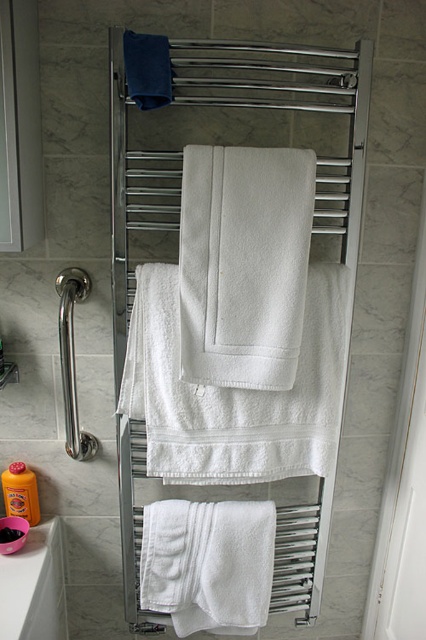
Who is lower down, chrome metallic grab bar at left or orange liquid soap at lower left?

orange liquid soap at lower left is below.

Is chrome metallic grab bar at left smaller than orange liquid soap at lower left?

No.

Where is `chrome metallic grab bar at left`? This screenshot has width=426, height=640. chrome metallic grab bar at left is located at coordinates (71, 360).

How much distance is there between white cotton towel at center and white ceramic sink at lower left?

white cotton towel at center is 18.27 inches away from white ceramic sink at lower left.

What do you see at coordinates (235, 392) in the screenshot? I see `white cotton towel at center` at bounding box center [235, 392].

Where is `white cotton towel at center`? This screenshot has height=640, width=426. white cotton towel at center is located at coordinates (235, 392).

At what (x,y) coordinates should I click in order to perform the action: click on white cotton towel at center. Please return your answer as a coordinate pair (x, y). This screenshot has width=426, height=640. Looking at the image, I should click on (235, 392).

Is white soft towel at lower center thinner than white ceramic sink at lower left?

No, white soft towel at lower center is not thinner than white ceramic sink at lower left.

Is point (192, 508) positioned behind point (32, 614)?

Yes, it is behind point (32, 614).

What are the coordinates of `white soft towel at lower center` in the screenshot? It's located at (207, 563).